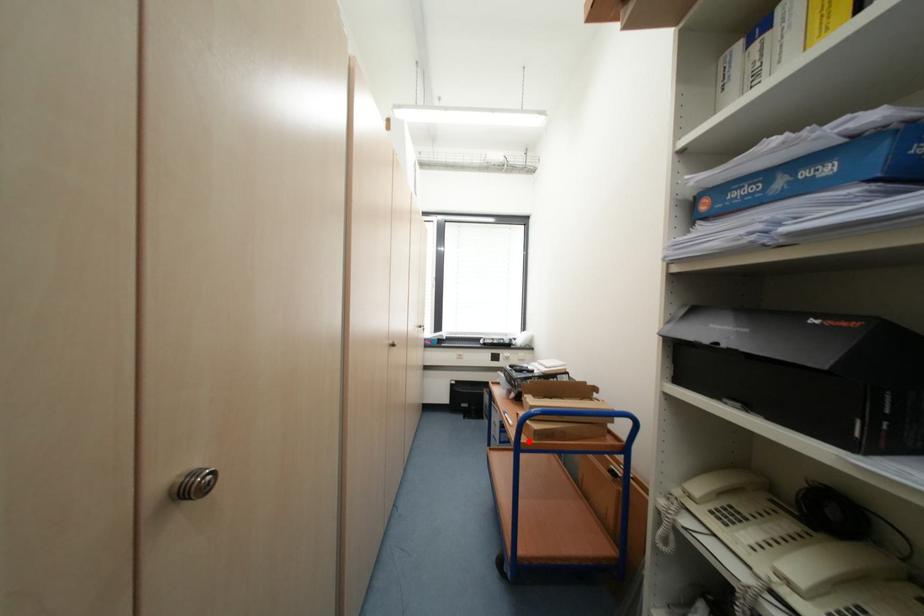
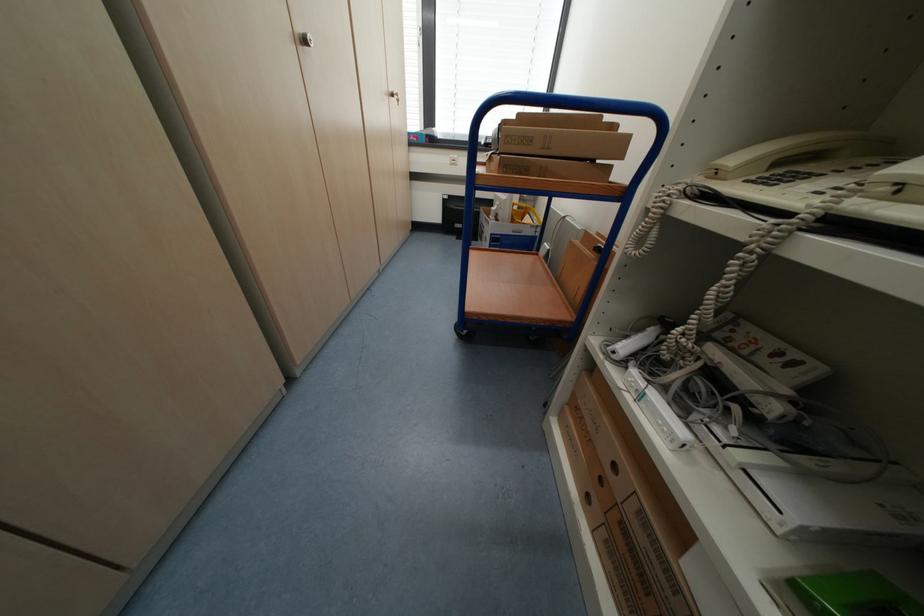
The point at the highlighted location is marked in the first image. Where is the corresponding point in the second image?

(485, 171)